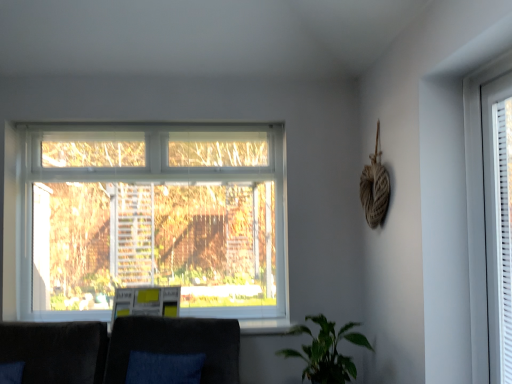
The width and height of the screenshot is (512, 384). Describe the element at coordinates (326, 351) in the screenshot. I see `green matte plant at lower right` at that location.

Locate an element on the screen. This screenshot has width=512, height=384. white plastic window at right is located at coordinates [x=477, y=211].

Is green matte plant at lower right facing away from white plastic window at right?

No, white plastic window at right is not at the back of green matte plant at lower right.

From a real-world perspective, which is physically below, green matte plant at lower right or white plastic window at right?

From a 3D spatial view, green matte plant at lower right is below.

Is green matte plant at lower right not inside white plastic window at right?

Indeed, green matte plant at lower right is completely outside white plastic window at right.

Which of these two, green matte plant at lower right or white plastic window at right, is wider?

Wider between the two is green matte plant at lower right.

Could you tell me if white plastic window at right is turned towards velvet dark gray couch at lower center?

No, white plastic window at right is not aimed at velvet dark gray couch at lower center.

Based on the photo, how distant is white plastic window at right from velvet dark gray couch at lower center?

The distance of white plastic window at right from velvet dark gray couch at lower center is 5.49 feet.

Consider the image. Considering the positions of objects white plastic window at right and velvet dark gray couch at lower center in the image provided, who is more to the right, white plastic window at right or velvet dark gray couch at lower center?

From the viewer's perspective, white plastic window at right appears more on the right side.

Which of these two, white plastic window at right or velvet dark gray couch at lower center, is bigger?

With larger size is velvet dark gray couch at lower center.

Is green matte plant at lower right facing towards velvet dark gray couch at lower center?

No, green matte plant at lower right does not turn towards velvet dark gray couch at lower center.

Would you say green matte plant at lower right is a long distance from velvet dark gray couch at lower center?

That's not correct — green matte plant at lower right is a little close to velvet dark gray couch at lower center.

Which is in front, point (316, 367) or point (82, 368)?

Point (316, 367)

From the image's perspective, which one is positioned higher, green matte plant at lower right or velvet dark gray couch at lower center?

green matte plant at lower right.

This screenshot has width=512, height=384. I want to click on window lying in front of the velvet dark gray couch at lower center, so click(477, 211).

Can you tell me how much velvet dark gray couch at lower center and white plastic window at right differ in facing direction?

The angular difference between velvet dark gray couch at lower center and white plastic window at right is 179 degrees.

Can you see velvet dark gray couch at lower center touching white plastic window at right?

No, velvet dark gray couch at lower center is not in contact with white plastic window at right.

From a real-world perspective, relative to white plastic window at right, is velvet dark gray couch at lower center vertically above or below?

Clearly, from a real-world perspective, velvet dark gray couch at lower center is below white plastic window at right.

From the picture: In the image, is white plastic window at right positioned in front of or behind green matte plant at lower right?

In the image, white plastic window at right appears in front of green matte plant at lower right.

Considering the points (480, 149) and (329, 353), which point is in front, point (480, 149) or point (329, 353)?

Point (480, 149)

Is white plastic window at right positioned far away from green matte plant at lower right?

Actually, white plastic window at right and green matte plant at lower right are a little close together.

Considering the relative sizes of white plastic window at right and green matte plant at lower right in the image provided, is white plastic window at right smaller than green matte plant at lower right?

Indeed, white plastic window at right has a smaller size compared to green matte plant at lower right.

Which is nearer, (14,348) or (341,373)?

Clearly, point (14,348) is more distant from the camera than point (341,373).

Choose the correct answer: Is velvet dark gray couch at lower center inside green matte plant at lower right or outside it?

velvet dark gray couch at lower center exists outside the volume of green matte plant at lower right.

Where is `houseplant behind the velvet dark gray couch at lower center`? Image resolution: width=512 pixels, height=384 pixels. houseplant behind the velvet dark gray couch at lower center is located at coordinates (326, 351).

Which of these two, velvet dark gray couch at lower center or green matte plant at lower right, is smaller?

green matte plant at lower right is smaller.

Identify the location of houseplant that appears behind the white plastic window at right. (326, 351).

The height and width of the screenshot is (384, 512). In order to click on couch located underneath the white plastic window at right (from a real-world perspective) in this screenshot , I will do `click(121, 352)`.

Estimate the real-world distances between objects in this image. Which object is closer to velvet dark gray couch at lower center, green matte plant at lower right or white plastic window at right?

Among the two, green matte plant at lower right is located nearer to velvet dark gray couch at lower center.

Looking at the image, which one is located further to white plastic window at right, green matte plant at lower right or velvet dark gray couch at lower center?

velvet dark gray couch at lower center is positioned further to the anchor white plastic window at right.

Based on their spatial positions, is velvet dark gray couch at lower center or white plastic window at right closer to green matte plant at lower right?

The object closer to green matte plant at lower right is velvet dark gray couch at lower center.

From the image, which object appears to be nearer to green matte plant at lower right, white plastic window at right or velvet dark gray couch at lower center?

Based on the image, velvet dark gray couch at lower center appears to be nearer to green matte plant at lower right.

Considering their positions, is white plastic window at right positioned further to velvet dark gray couch at lower center than green matte plant at lower right?

Based on the image, white plastic window at right appears to be further to velvet dark gray couch at lower center.

From the image, which object appears to be nearer to white plastic window at right, velvet dark gray couch at lower center or green matte plant at lower right?

green matte plant at lower right is closer to white plastic window at right.

Identify the location of houseplant between velvet dark gray couch at lower center and white plastic window at right. The width and height of the screenshot is (512, 384). (326, 351).